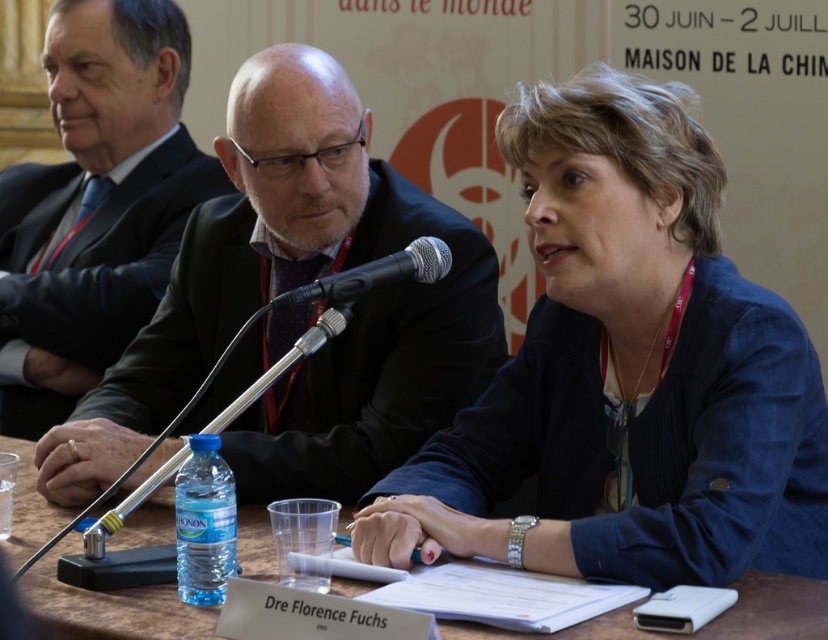
Question: Is the position of dark suit at center more distant than that of black metallic microphone at center?

Choices:
 (A) no
 (B) yes

Answer: (B)

Question: Does blue fabric jacket at center appear on the right side of matte black suit at center?

Choices:
 (A) yes
 (B) no

Answer: (A)

Question: Observing the image, what is the correct spatial positioning of blue fabric jacket at center in reference to dark suit at center?

Choices:
 (A) above
 (B) below

Answer: (B)

Question: Which of these objects is positioned closest to the brown wooden table at center?

Choices:
 (A) dark suit at center
 (B) blue fabric jacket at center

Answer: (B)

Question: Which object appears farthest from the camera in this image?

Choices:
 (A) black metallic microphone at center
 (B) blue fabric jacket at center
 (C) dark suit at center
 (D) matte black suit at center

Answer: (C)

Question: Which point is closer to the camera?

Choices:
 (A) brown wooden table at center
 (B) black metallic microphone at center
 (C) dark suit at center

Answer: (A)